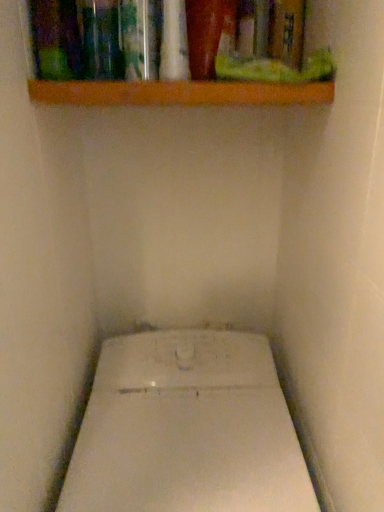
Question: Can you confirm if white glossy toilet at center is positioned to the right of wooden shelf at upper center?

Choices:
 (A) yes
 (B) no

Answer: (A)

Question: Is white glossy toilet at center aimed at wooden shelf at upper center?

Choices:
 (A) no
 (B) yes

Answer: (A)

Question: From the image's perspective, is white glossy toilet at center located beneath wooden shelf at upper center?

Choices:
 (A) yes
 (B) no

Answer: (A)

Question: From the image's perspective, is white glossy toilet at center over wooden shelf at upper center?

Choices:
 (A) yes
 (B) no

Answer: (B)

Question: Is white glossy toilet at center touching wooden shelf at upper center?

Choices:
 (A) no
 (B) yes

Answer: (A)

Question: Is wooden shelf at upper center inside white glossy toilet at center?

Choices:
 (A) no
 (B) yes

Answer: (A)

Question: Can you confirm if wooden shelf at upper center is wider than white glossy toilet at center?

Choices:
 (A) yes
 (B) no

Answer: (B)

Question: Is wooden shelf at upper center smaller than white glossy toilet at center?

Choices:
 (A) no
 (B) yes

Answer: (B)

Question: Would you say wooden shelf at upper center contains white glossy toilet at center?

Choices:
 (A) no
 (B) yes

Answer: (A)

Question: Considering the relative positions of wooden shelf at upper center and white glossy toilet at center in the image provided, is wooden shelf at upper center in front of white glossy toilet at center?

Choices:
 (A) yes
 (B) no

Answer: (B)

Question: Is wooden shelf at upper center with white glossy toilet at center?

Choices:
 (A) no
 (B) yes

Answer: (A)

Question: Considering the relative sizes of wooden shelf at upper center and white glossy toilet at center in the image provided, is wooden shelf at upper center thinner than white glossy toilet at center?

Choices:
 (A) no
 (B) yes

Answer: (B)

Question: Do you think wooden shelf at upper center is within white glossy toilet at center, or outside of it?

Choices:
 (A) inside
 (B) outside

Answer: (B)